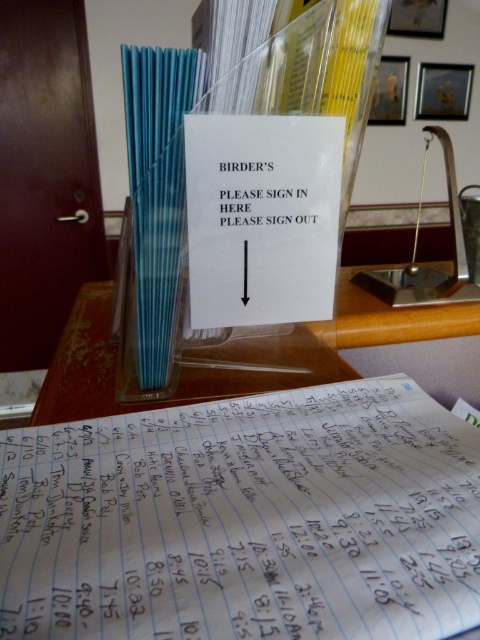
Is blue lined paper at center wider than white paper at center?

Yes.

Between blue lined paper at center and white paper at center, which one has less height?

blue lined paper at center

Is point (267, 577) farther from viewer compared to point (244, 317)?

No, it is not.

Identify the location of blue lined paper at center. Image resolution: width=480 pixels, height=640 pixels. (245, 520).

Is white paper at center taller than white paper sign at center?

Indeed, white paper at center has a greater height compared to white paper sign at center.

Is white paper at center positioned at the back of white paper sign at center?

No.

This screenshot has height=640, width=480. Describe the element at coordinates (262, 218) in the screenshot. I see `white paper at center` at that location.

Where is `white paper at center`? Image resolution: width=480 pixels, height=640 pixels. white paper at center is located at coordinates (262, 218).

Between point (39, 449) and point (252, 220), which one is positioned behind?

Positioned behind is point (252, 220).

Between blue lined paper at center and white paper sign at center, which one appears on the left side from the viewer's perspective?

white paper sign at center is more to the left.

The height and width of the screenshot is (640, 480). Find the location of `blue lined paper at center`. blue lined paper at center is located at coordinates (245, 520).

Locate an element on the screen. blue lined paper at center is located at coordinates (245, 520).